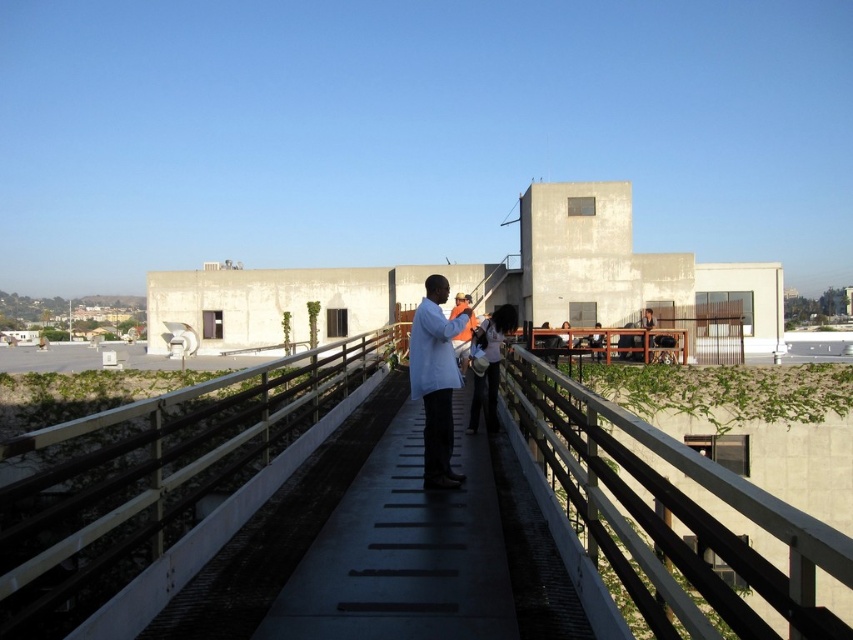
You are standing on the rooftop walkway and see the light blue fabric coat at center. If you were to walk straight ahead towards the building in the background, would the coat be in your path?

The light blue fabric coat at center is located at coordinates approximately 0.594 along the horizontal axis and 0.511 vertically. Since the walkway is narrow and centered, the coat is likely positioned along the central path. Therefore, walking straight ahead towards the building would place the coat directly in your path.

You are standing on the rooftop walkway and see both the light blue fabric coat at center and the white fabric bag at center. Which item is positioned more to the left side of the walkway?

The light blue fabric coat at center is positioned more to the left side of the walkway compared to the white fabric bag at center.